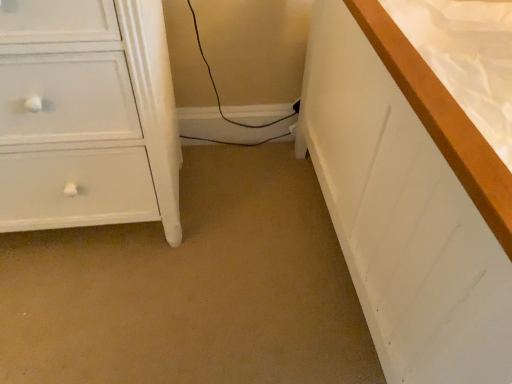
Question: In the image, is white wood bed at right positioned in front of or behind white painted wood chest of drawers at left?

Choices:
 (A) behind
 (B) front

Answer: (B)

Question: Based on their sizes in the image, would you say white wood bed at right is bigger or smaller than white painted wood chest of drawers at left?

Choices:
 (A) small
 (B) big

Answer: (B)

Question: From a real-world perspective, is white wood bed at right physically located above or below white painted wood chest of drawers at left?

Choices:
 (A) below
 (B) above

Answer: (B)

Question: In terms of height, does white painted wood chest of drawers at left look taller or shorter compared to white wood bed at right?

Choices:
 (A) short
 (B) tall

Answer: (A)

Question: Considering the positions of point (155, 59) and point (416, 99), is point (155, 59) closer or farther from the camera than point (416, 99)?

Choices:
 (A) closer
 (B) farther

Answer: (B)

Question: From the image's perspective, is white painted wood chest of drawers at left above or below white wood bed at right?

Choices:
 (A) above
 (B) below

Answer: (A)

Question: Is white painted wood chest of drawers at left inside or outside of white wood bed at right?

Choices:
 (A) outside
 (B) inside

Answer: (A)